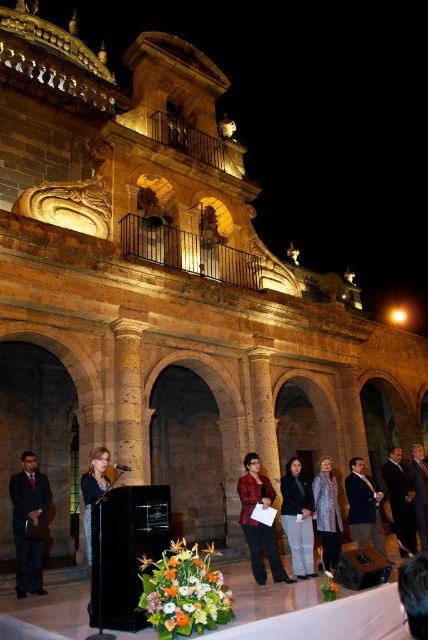
Question: Among these points, which one is nearest to the camera?

Choices:
 (A) (303, 577)
 (B) (410, 608)

Answer: (B)

Question: Which of the following is the closest to the observer?

Choices:
 (A) (91, 515)
 (B) (412, 525)
 (C) (360, 486)
 (D) (258, 465)

Answer: (A)

Question: Does dark brown hair at lower right have a greater width compared to dark suit at right?

Choices:
 (A) no
 (B) yes

Answer: (B)

Question: Can you confirm if matte black dress at center is bigger than dark suit at right?

Choices:
 (A) no
 (B) yes

Answer: (B)

Question: Which object is positioned farthest from the dark blue suit at center?

Choices:
 (A) matte black jacket at center
 (B) matte black dress at center
 (C) dark brown hair at lower right

Answer: (B)

Question: Is dark suit at left wider than plaid fabric shirt at center?

Choices:
 (A) no
 (B) yes

Answer: (B)